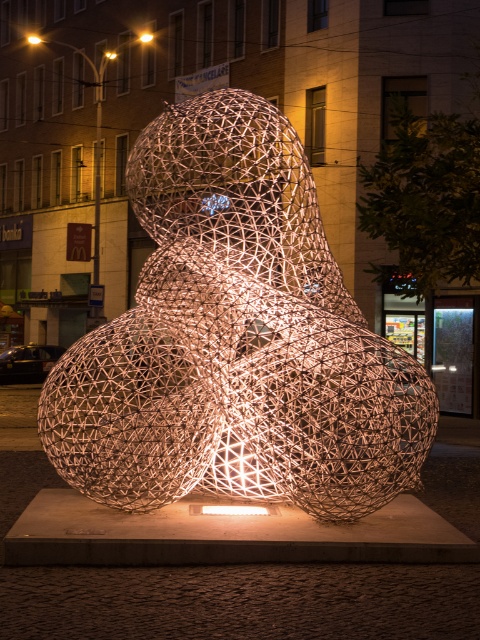
You are standing at the base of the sculpture and want to place a small bench between the matte gold light at center and the McDonalds sign on the left. Can you fit the bench if it is 2 meters long?

The distance between the matte gold light at center and the McDonalds sign on the left is 25.06 meters. Since the bench is only 2 meters long, there is enough space to place it between them.

You are standing in front of the wireframe duck sculpture at night. There is a point labeled as point (145, 36). Based on the description, what color is the light at this point?

The point (145, 36) indicates a bright yellow light at the center.